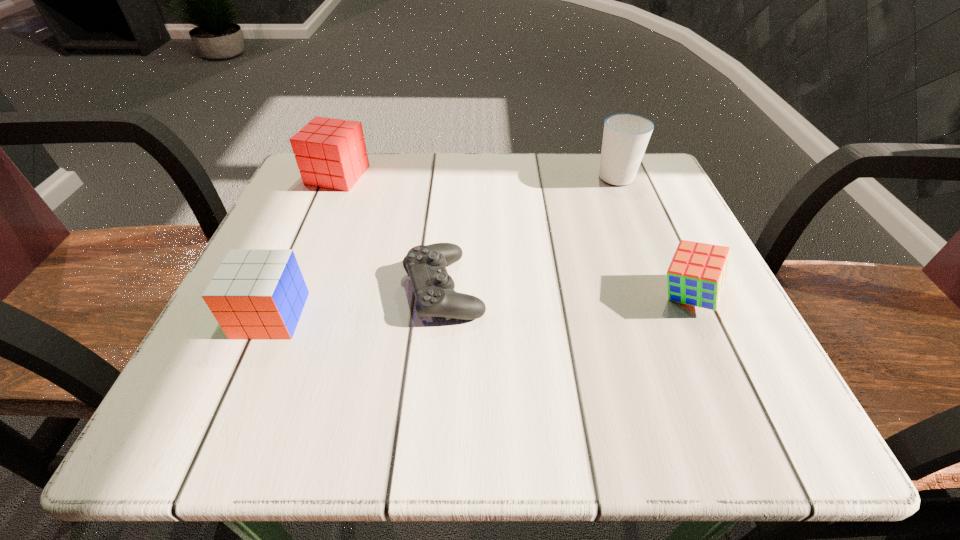
This screenshot has width=960, height=540. I want to click on cup, so click(x=625, y=137).

This screenshot has height=540, width=960. Identify the location of the farthest cube. (331, 153).

This screenshot has width=960, height=540. I want to click on the rightmost cube, so click(698, 272).

Where is `control`? control is located at coordinates (433, 288).

Locate an element on the screen. Image resolution: width=960 pixels, height=540 pixels. the shortest object is located at coordinates (433, 288).

You are a GUI agent. You are given a task and a screenshot of the screen. Output one action in this format:
    pyautogui.click(x=<x>, y=<y>)
    Task: Click on the vacant space located 0.310m on the right of the farthest cube
    Image resolution: width=960 pixels, height=540 pixels.
    Given the screenshot: What is the action you would take?
    point(508,176)

Locate an element on the screen. vacant space located on the front of the rightmost cube is located at coordinates (735, 402).

At what (x,y) coordinates should I click in order to perform the action: click on free space located on the right of the shortest object. Please return your answer as a coordinate pair (x, y). The height and width of the screenshot is (540, 960). Looking at the image, I should click on (709, 288).

I want to click on cup that is at the far edge, so click(625, 137).

Locate an element on the screen. The width and height of the screenshot is (960, 540). cube that is at the far edge is located at coordinates (331, 153).